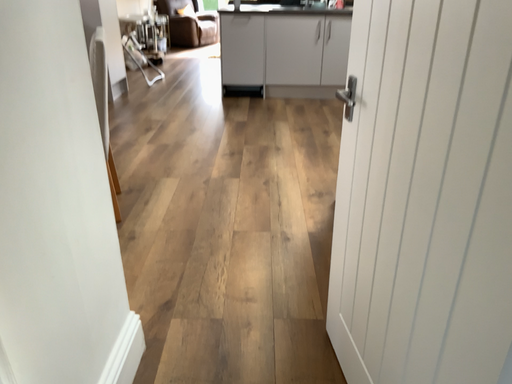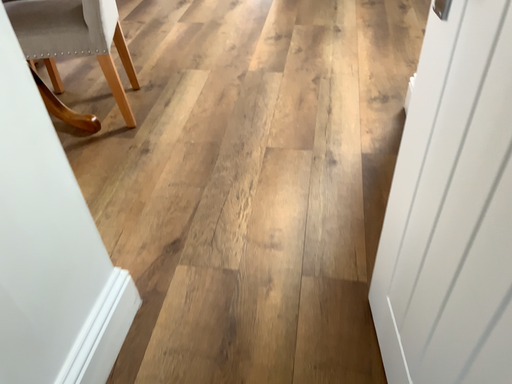
Question: How did the camera likely rotate when shooting the video?

Choices:
 (A) rotated left
 (B) rotated right

Answer: (A)